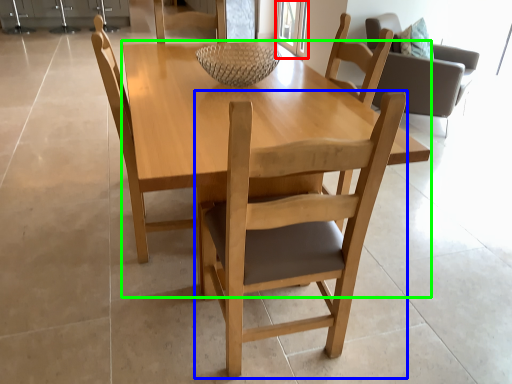
Question: Considering the real-world distances, which object is farthest from glass door (highlighted by a red box)? chair (highlighted by a blue box) or round table (highlighted by a green box)?

Choices:
 (A) chair
 (B) round table

Answer: (A)